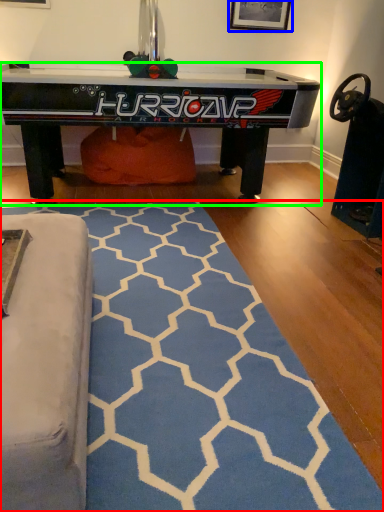
Question: Which object is positioned closest to mat (highlighted by a red box)? Select from picture frame (highlighted by a blue box) and table (highlighted by a green box).

Choices:
 (A) picture frame
 (B) table

Answer: (B)